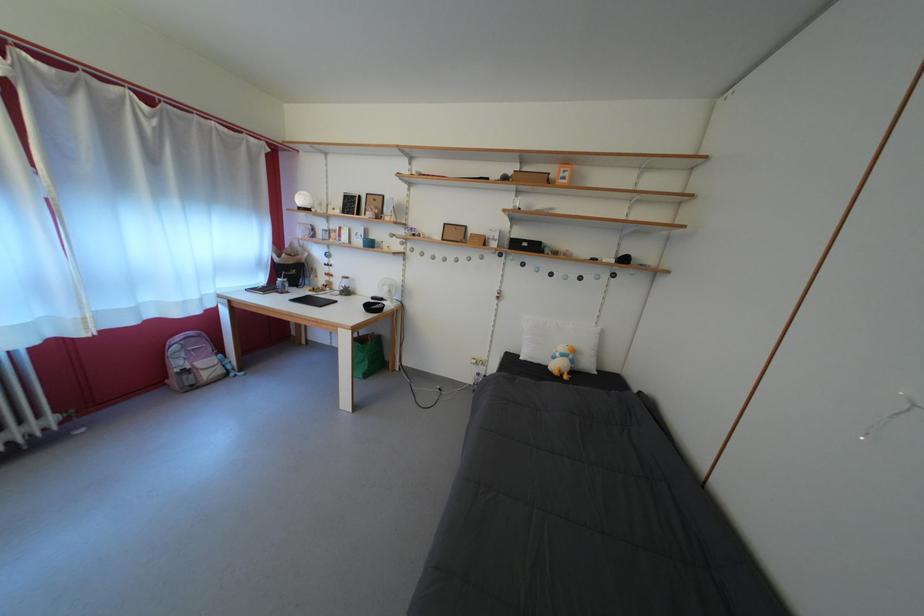
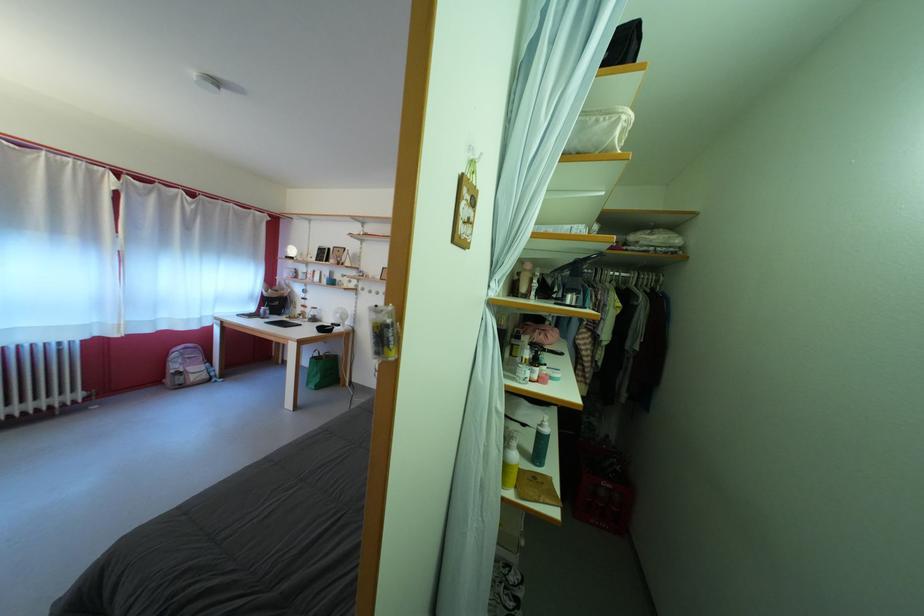
In the second image, find the point that corresponds to point (356, 299) in the first image.

(322, 325)